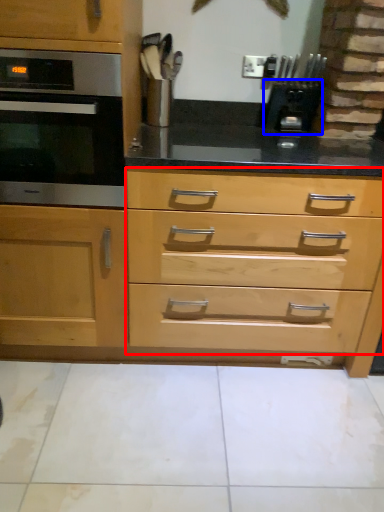
Question: Which object appears closest to the camera in this image, drawer (highlighted by a red box) or appliance (highlighted by a blue box)?

Choices:
 (A) drawer
 (B) appliance

Answer: (A)